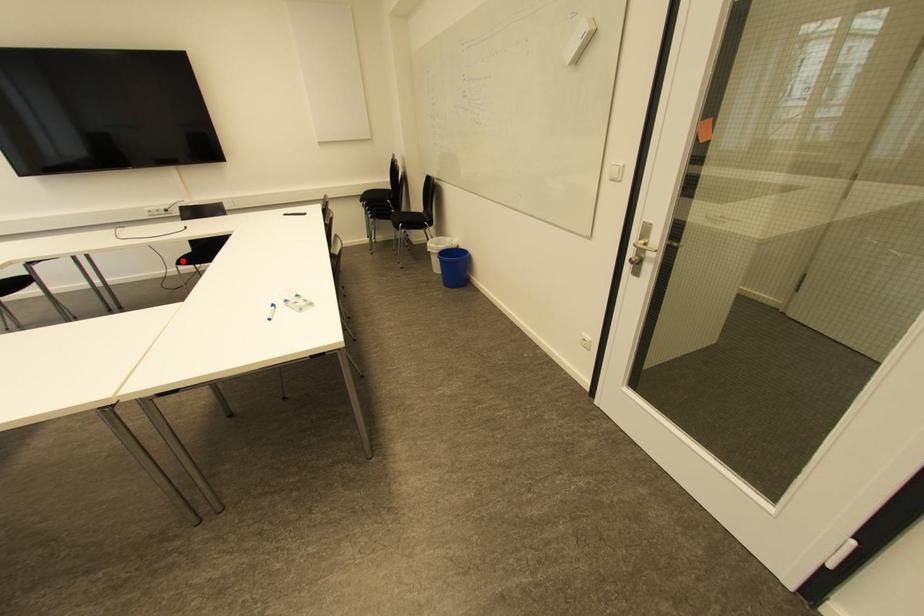
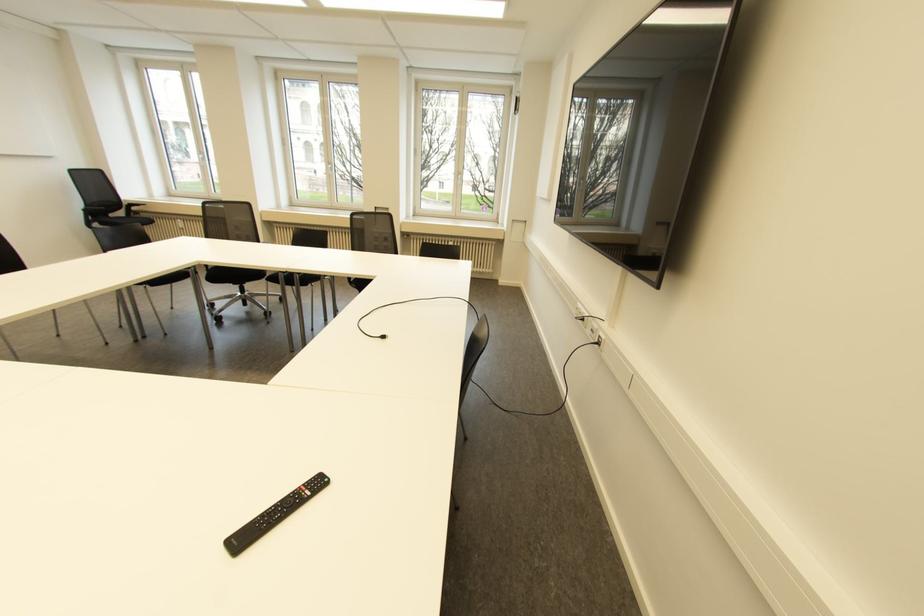
Question: I am providing you with two images of the same scene from different viewpoints. A red point is marked on the first image. At the location where the point appears in image 1, is it still visible in image 2?

Choices:
 (A) Yes
 (B) No

Answer: (B)